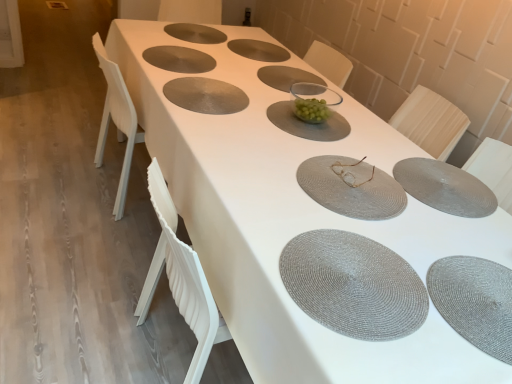
This screenshot has height=384, width=512. What are the coordinates of `free area in between matte gray placemat at upper center, the third tableware from the top, and gray woven placemat at center` in the screenshot? It's located at (234, 136).